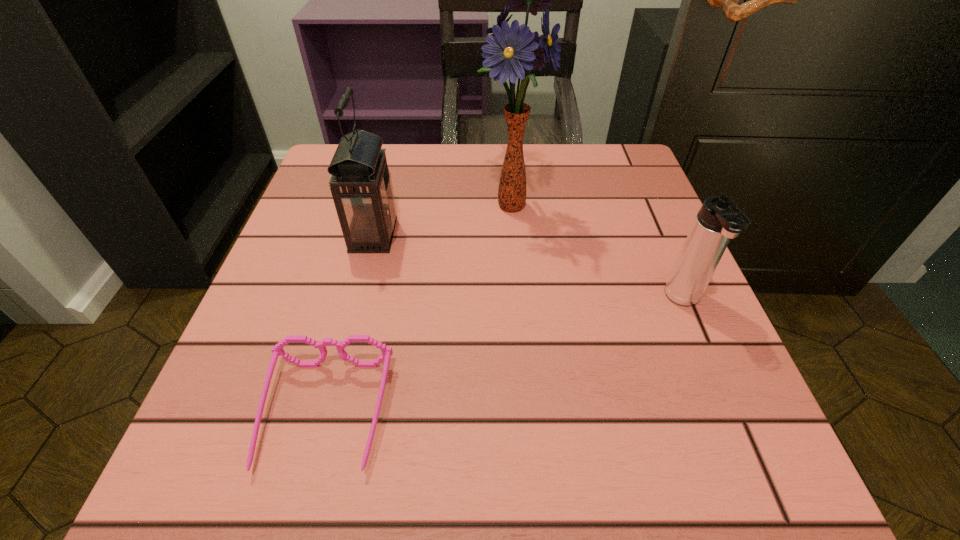
I want to click on vacant position at the far right corner of the desktop, so click(x=592, y=193).

Find the location of `vacant space at the near right corner of the desktop`. vacant space at the near right corner of the desktop is located at coordinates (716, 491).

This screenshot has width=960, height=540. Identify the location of free spot between the second tallest object and the nearest object. (349, 325).

Locate an element on the screen. The image size is (960, 540). unoccupied position between the lantern and the third farthest object is located at coordinates (529, 268).

The image size is (960, 540). In order to click on free space between the nearest object and the third shortest object in this screenshot , I will do `click(349, 325)`.

The width and height of the screenshot is (960, 540). Find the location of `vacant space that is in between the rightmost object and the spectacles`. vacant space that is in between the rightmost object and the spectacles is located at coordinates (505, 358).

Locate an element on the screen. empty location between the shortest object and the flower arrangement is located at coordinates (418, 309).

Identify the location of empty space between the second nearest object and the spectacles. The image size is (960, 540). (505, 358).

Where is `empty space between the nearest object and the thermos bottle`? This screenshot has height=540, width=960. empty space between the nearest object and the thermos bottle is located at coordinates (505, 358).

Image resolution: width=960 pixels, height=540 pixels. Identify the location of free space between the second object from right to left and the spectacles. (418, 309).